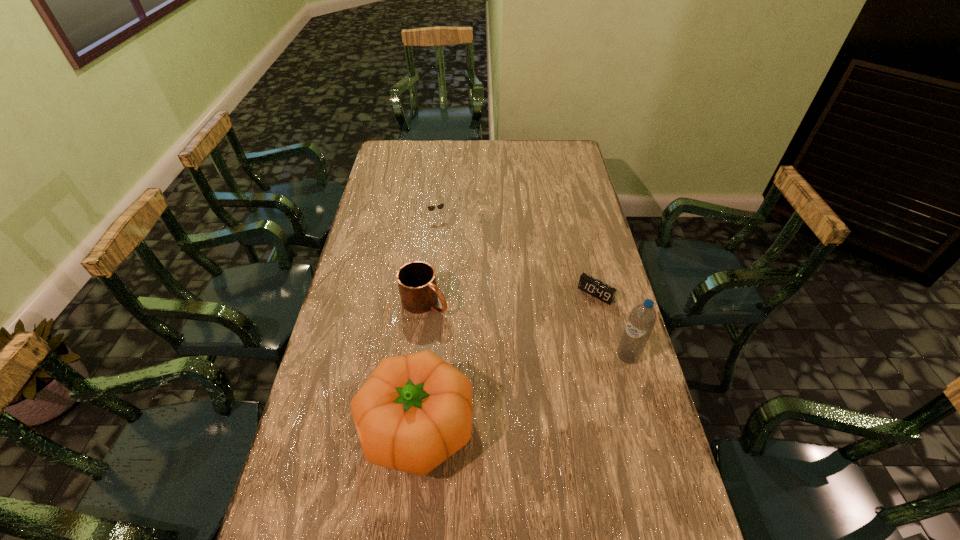
Locate an element on the screen. free space between the mug and the second nearest object is located at coordinates (526, 329).

Where is `free space between the farthest object and the third tallest object`? This screenshot has height=540, width=960. free space between the farthest object and the third tallest object is located at coordinates (431, 259).

At what (x,y) coordinates should I click in order to perform the action: click on free spot between the water bottle and the nearest object. Please return your answer as a coordinate pair (x, y). Looking at the image, I should click on (521, 392).

Where is `free space that is in between the shortest object and the farthest object`? The width and height of the screenshot is (960, 540). free space that is in between the shortest object and the farthest object is located at coordinates (516, 255).

Find the location of a particular element. The height and width of the screenshot is (540, 960). free spot between the shortest object and the farthest object is located at coordinates (516, 255).

Identify the location of vacant space in between the pumpkin and the fourth tallest object. (426, 321).

At what (x,y) coordinates should I click in order to perform the action: click on free space that is in between the mug and the fourth farthest object. Please return your answer as a coordinate pair (x, y). This screenshot has height=540, width=960. Looking at the image, I should click on (526, 329).

Find the location of a particular element. Image resolution: width=960 pixels, height=540 pixels. object that is the closest to the mug is located at coordinates (414, 411).

Locate which object is the second closest to the nearest object. Please provide its 2D coordinates. Your answer should be formatted as a tuple, i.e. [(x, y)], where the tuple contains the x and y coordinates of a point satisfying the conditions above.

[(642, 319)]

Identify the location of vacant space that satisfies the following two spatial constraints: 1. on the front side of the nearest object; 2. on the carved face of the sunglasses. (415, 427).